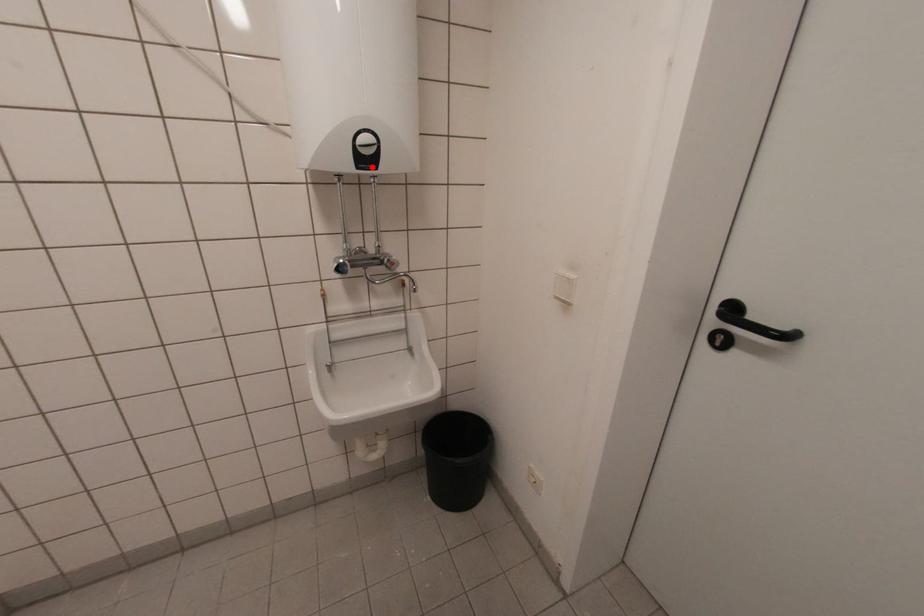
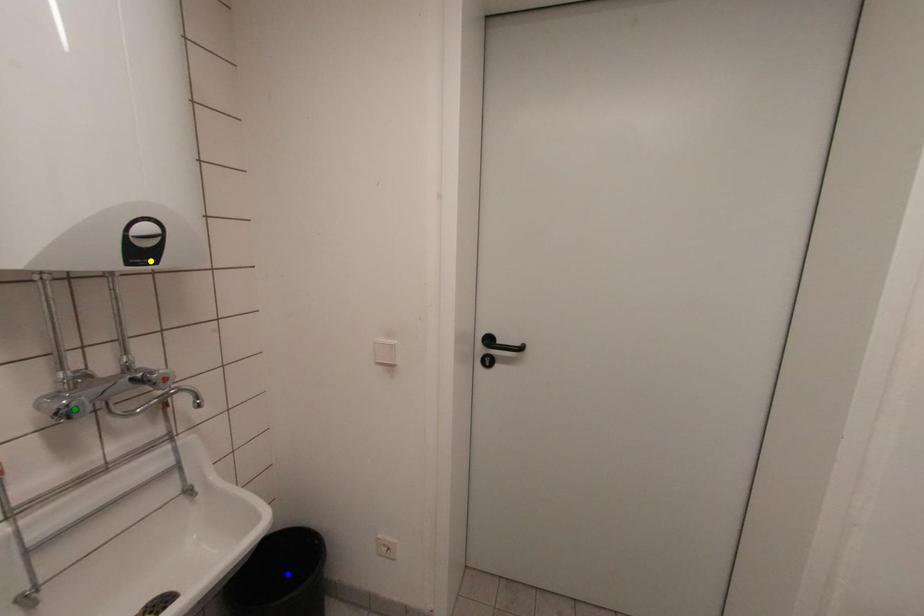
Question: I am providing you with two images of the same scene from different viewpoints. A red point is marked on the first image. You are given multiple points on the second image. In image 2, which mark is for the same physical point as the one in image 1?

Choices:
 (A) green point
 (B) yellow point
 (C) blue point

Answer: (B)